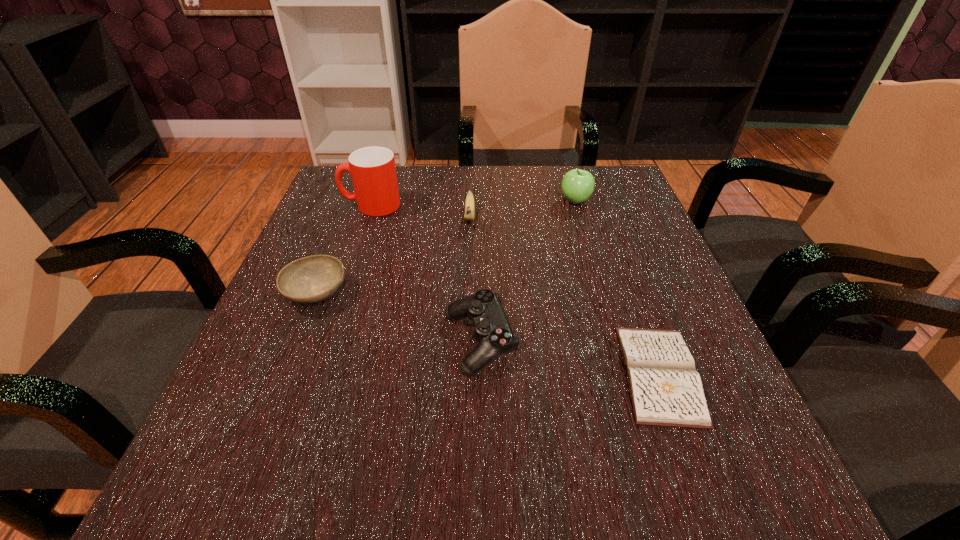
I want to click on the tallest object, so click(x=372, y=169).

This screenshot has height=540, width=960. What are the coordinates of `apple` in the screenshot? It's located at [577, 185].

The image size is (960, 540). What are the coordinates of `banana` in the screenshot? It's located at click(x=469, y=214).

This screenshot has width=960, height=540. In order to click on control in this screenshot , I will do `click(492, 329)`.

The width and height of the screenshot is (960, 540). Find the location of `the fifth tallest object`. the fifth tallest object is located at coordinates (311, 279).

Identify the location of the shortest object. This screenshot has width=960, height=540. (666, 390).

You are a GUI agent. You are given a task and a screenshot of the screen. Output one action in this format:
    pyautogui.click(x=<x>, y=<y>)
    Task: Click on the free space located 0.280m on the front of the fifth shortest object
    
    Given the screenshot: What is the action you would take?
    pyautogui.click(x=603, y=294)

What are the coordinates of `free space located at the stem of the banana` in the screenshot? It's located at (468, 271).

Where is `vacant area located on the right of the control`? This screenshot has width=960, height=540. vacant area located on the right of the control is located at coordinates (553, 342).

Where is `free spot located on the right of the fifth tallest object`? The width and height of the screenshot is (960, 540). free spot located on the right of the fifth tallest object is located at coordinates (381, 293).